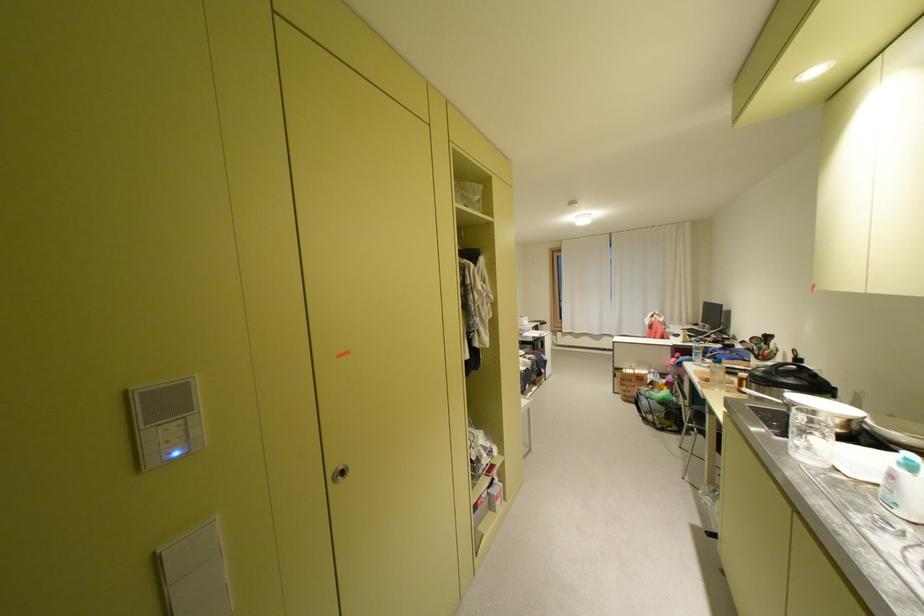
Locate an element on the screen. The width and height of the screenshot is (924, 616). white intercom button is located at coordinates (174, 448).